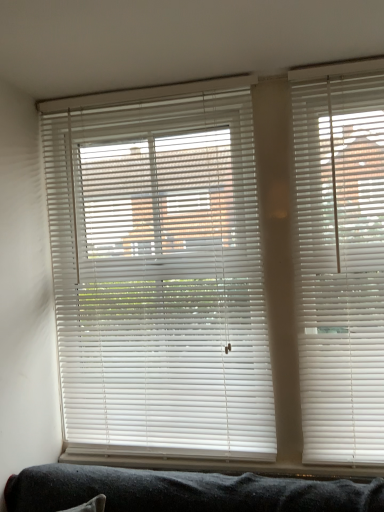
How much space does white plastic blinds at right, marked as the second window blind in a left-to-right arrangement, occupy vertically?

It is 4.84 feet.

The image size is (384, 512). What do you see at coordinates (340, 259) in the screenshot?
I see `white plastic blinds at right, marked as the second window blind in a left-to-right arrangement` at bounding box center [340, 259].

You are a GUI agent. You are given a task and a screenshot of the screen. Output one action in this format:
    pyautogui.click(x=<x>, y=<y>)
    Task: Click on the white plastic blinds at right, marked as the second window blind in a left-to-right arrangement
    
    Given the screenshot: What is the action you would take?
    pyautogui.click(x=340, y=259)

What do you see at coordinates (159, 272) in the screenshot? The width and height of the screenshot is (384, 512). I see `white matte blinds at center, which is counted as the 1th window blind, starting from the back` at bounding box center [159, 272].

Find the location of a particular element. The width and height of the screenshot is (384, 512). white matte blinds at center, the 1th window blind in the left-to-right sequence is located at coordinates (159, 272).

Locate an element on the screen. white plastic blinds at right, marked as the second window blind in a left-to-right arrangement is located at coordinates (340, 259).

Which is more to the right, white plastic blinds at right, the second window blind when ordered from back to front, or white matte blinds at center, the 1th window blind in the left-to-right sequence?

white plastic blinds at right, the second window blind when ordered from back to front, is more to the right.

Considering the relative positions of white plastic blinds at right, the second window blind when ordered from back to front, and white matte blinds at center, the 1th window blind in the left-to-right sequence, in the image provided, is white plastic blinds at right, the second window blind when ordered from back to front, in front of white matte blinds at center, the 1th window blind in the left-to-right sequence,?

Yes.

Does point (377, 280) appear closer or farther from the camera than point (214, 144)?

Point (377, 280) appears to be closer to the viewer than point (214, 144).

From the image's perspective, who appears lower, white plastic blinds at right, the 1th window blind viewed from the front, or white matte blinds at center, which ranks as the second window blind in front-to-back order?

From the image's view, white matte blinds at center, which ranks as the second window blind in front-to-back order, is below.

From a real-world perspective, who is located lower, white plastic blinds at right, the 1th window blind when ordered from right to left, or white matte blinds at center, the 1th window blind in the left-to-right sequence?

white plastic blinds at right, the 1th window blind when ordered from right to left, is physically lower.

Does white plastic blinds at right, marked as the second window blind in a left-to-right arrangement, have a greater width compared to white matte blinds at center, which is counted as the 1th window blind, starting from the back?

Indeed, white plastic blinds at right, marked as the second window blind in a left-to-right arrangement, has a greater width compared to white matte blinds at center, which is counted as the 1th window blind, starting from the back.

From their relative heights in the image, would you say white plastic blinds at right, the 1th window blind viewed from the front, is taller or shorter than white matte blinds at center, which appears as the second window blind when viewed from the right?

In the image, white plastic blinds at right, the 1th window blind viewed from the front, appears to be shorter than white matte blinds at center, which appears as the second window blind when viewed from the right.

In the scene shown: Between white plastic blinds at right, marked as the second window blind in a left-to-right arrangement, and white matte blinds at center, which ranks as the second window blind in front-to-back order, which one has larger size?

With larger size is white matte blinds at center, which ranks as the second window blind in front-to-back order.

Do you think white plastic blinds at right, marked as the second window blind in a left-to-right arrangement, is within white matte blinds at center, the 1th window blind in the left-to-right sequence, or outside of it?

white plastic blinds at right, marked as the second window blind in a left-to-right arrangement, lies outside white matte blinds at center, the 1th window blind in the left-to-right sequence.

Are white plastic blinds at right, the 1th window blind viewed from the front, and white matte blinds at center, which appears as the second window blind when viewed from the right, beside each other?

No.

Is white matte blinds at center, which ranks as the second window blind in front-to-back order, at the back of white plastic blinds at right, the second window blind when ordered from back to front?

No, white matte blinds at center, which ranks as the second window blind in front-to-back order, is not at the back of white plastic blinds at right, the second window blind when ordered from back to front.

At what (x,y) coordinates should I click in order to perform the action: click on window blind above the white plastic blinds at right, the 1th window blind viewed from the front (from a real-world perspective). Please return your answer as a coordinate pair (x, y). Image resolution: width=384 pixels, height=512 pixels. Looking at the image, I should click on (159, 272).

Considering the relative positions of white matte blinds at center, which is counted as the 1th window blind, starting from the back, and white plastic blinds at right, marked as the second window blind in a left-to-right arrangement, in the image provided, is white matte blinds at center, which is counted as the 1th window blind, starting from the back, to the right of white plastic blinds at right, marked as the second window blind in a left-to-right arrangement, from the viewer's perspective?

In fact, white matte blinds at center, which is counted as the 1th window blind, starting from the back, is to the left of white plastic blinds at right, marked as the second window blind in a left-to-right arrangement.

In the scene shown: Considering the positions of objects white matte blinds at center, which is counted as the 1th window blind, starting from the back, and white plastic blinds at right, the 1th window blind when ordered from right to left, in the image provided, who is behind, white matte blinds at center, which is counted as the 1th window blind, starting from the back, or white plastic blinds at right, the 1th window blind when ordered from right to left,?

white matte blinds at center, which is counted as the 1th window blind, starting from the back, is more distant.

Considering the positions of points (258, 256) and (364, 309), is point (258, 256) farther from camera compared to point (364, 309)?

Yes, it is.

In the scene shown: From the image's perspective, relative to white plastic blinds at right, the 1th window blind viewed from the front, is white matte blinds at center, which appears as the second window blind when viewed from the right, above or below?

From the image's perspective, white matte blinds at center, which appears as the second window blind when viewed from the right, appears below white plastic blinds at right, the 1th window blind viewed from the front.

From a real-world perspective, between white matte blinds at center, which ranks as the second window blind in front-to-back order, and white plastic blinds at right, the 1th window blind viewed from the front, who is vertically higher?

In real-world perspective, white matte blinds at center, which ranks as the second window blind in front-to-back order, is above.

Which object is thinner, white matte blinds at center, which ranks as the second window blind in front-to-back order, or white plastic blinds at right, marked as the second window blind in a left-to-right arrangement?

white matte blinds at center, which ranks as the second window blind in front-to-back order.

Based on the photo, considering the sizes of objects white matte blinds at center, which appears as the second window blind when viewed from the right, and white plastic blinds at right, the 1th window blind viewed from the front, in the image provided, who is shorter, white matte blinds at center, which appears as the second window blind when viewed from the right, or white plastic blinds at right, the 1th window blind viewed from the front,?

Standing shorter between the two is white plastic blinds at right, the 1th window blind viewed from the front.

Looking at the image, does white matte blinds at center, which is counted as the 1th window blind, starting from the back, seem bigger or smaller compared to white plastic blinds at right, the 1th window blind viewed from the front?

Clearly, white matte blinds at center, which is counted as the 1th window blind, starting from the back, is larger in size than white plastic blinds at right, the 1th window blind viewed from the front.

Is white matte blinds at center, which appears as the second window blind when viewed from the right, inside the boundaries of white plastic blinds at right, the 1th window blind when ordered from right to left, or outside?

white matte blinds at center, which appears as the second window blind when viewed from the right, lies outside white plastic blinds at right, the 1th window blind when ordered from right to left.

Is white matte blinds at center, which appears as the second window blind when viewed from the right, positioned far away from white plastic blinds at right, marked as the second window blind in a left-to-right arrangement?

white matte blinds at center, which appears as the second window blind when viewed from the right, is near white plastic blinds at right, marked as the second window blind in a left-to-right arrangement, not far away.

Is white matte blinds at center, the 1th window blind in the left-to-right sequence, aimed at white plastic blinds at right, the second window blind when ordered from back to front?

No.

At what (x,y) coordinates should I click in order to perform the action: click on window blind beneath the white matte blinds at center, which ranks as the second window blind in front-to-back order (from a real-world perspective). Please return your answer as a coordinate pair (x, y). Looking at the image, I should click on 340,259.

Where is `window blind beneath the white matte blinds at center, which ranks as the second window blind in front-to-back order (from a real-world perspective)`? The width and height of the screenshot is (384, 512). window blind beneath the white matte blinds at center, which ranks as the second window blind in front-to-back order (from a real-world perspective) is located at coordinates (340, 259).

The image size is (384, 512). I want to click on window blind that appears on the left of white plastic blinds at right, the 1th window blind viewed from the front, so click(159, 272).